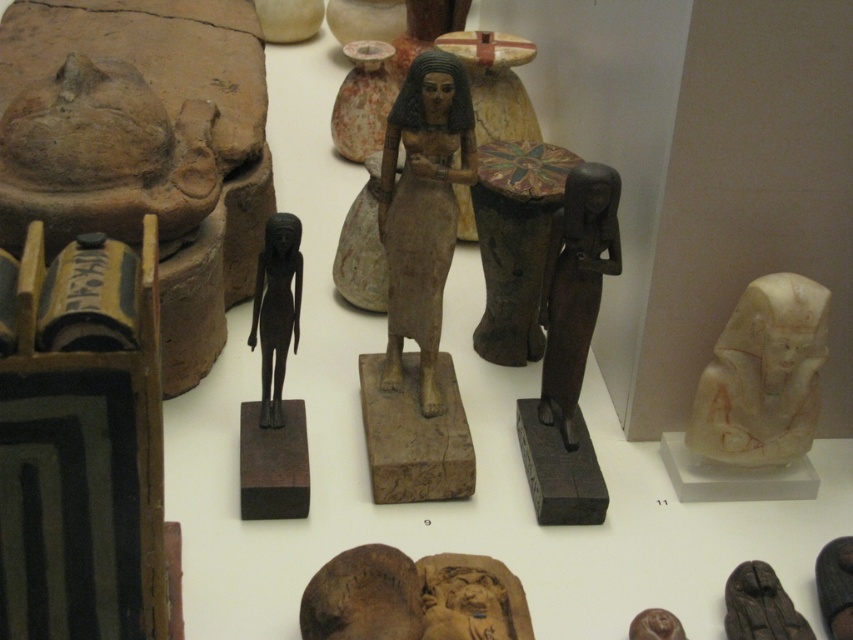
You are a museum visitor standing in front of the exhibit table. You see the white marble head at right and the black wood statue at lower right. Which object is closer to you?

The white marble head at right is closer to you because the black wood statue at lower right is behind it.